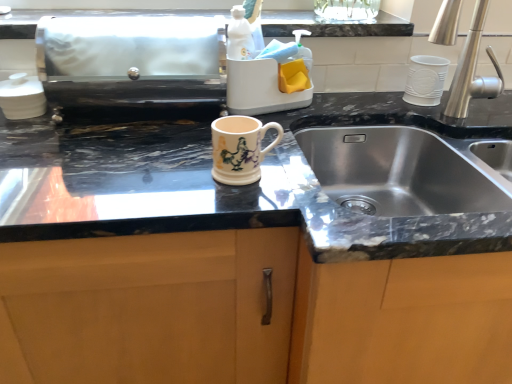
Question: From the image's perspective, would you say white glossy sink at upper center is shown under matte ceramic mug at center?

Choices:
 (A) yes
 (B) no

Answer: (B)

Question: From a real-world perspective, is white glossy sink at upper center positioned over matte ceramic mug at center based on gravity?

Choices:
 (A) yes
 (B) no

Answer: (A)

Question: From the image's perspective, is white glossy sink at upper center above matte ceramic mug at center?

Choices:
 (A) yes
 (B) no

Answer: (A)

Question: Is white glossy sink at upper center smaller than matte ceramic mug at center?

Choices:
 (A) yes
 (B) no

Answer: (B)

Question: Is white glossy sink at upper center taller than matte ceramic mug at center?

Choices:
 (A) yes
 (B) no

Answer: (B)

Question: From the image's perspective, relative to silver metallic faucet at right, is white glossy sink at upper center above or below?

Choices:
 (A) above
 (B) below

Answer: (A)

Question: Would you say white glossy sink at upper center is inside or outside silver metallic faucet at right?

Choices:
 (A) inside
 (B) outside

Answer: (B)

Question: Considering the positions of point (352, 33) and point (476, 82), is point (352, 33) closer or farther from the camera than point (476, 82)?

Choices:
 (A) closer
 (B) farther

Answer: (A)

Question: Considering the positions of white glossy sink at upper center and silver metallic faucet at right in the image, is white glossy sink at upper center taller or shorter than silver metallic faucet at right?

Choices:
 (A) tall
 (B) short

Answer: (B)

Question: From a real-world perspective, relative to matte ceramic mug at center, is silver metallic faucet at right vertically above or below?

Choices:
 (A) above
 (B) below

Answer: (A)

Question: Is point (502, 79) positioned closer to the camera than point (250, 170)?

Choices:
 (A) closer
 (B) farther

Answer: (B)

Question: Do you think silver metallic faucet at right is within matte ceramic mug at center, or outside of it?

Choices:
 (A) inside
 (B) outside

Answer: (B)

Question: Looking at their shapes, would you say silver metallic faucet at right is wider or thinner than matte ceramic mug at center?

Choices:
 (A) wide
 (B) thin

Answer: (A)

Question: Is point (45, 11) positioned closer to the camera than point (271, 122)?

Choices:
 (A) farther
 (B) closer

Answer: (A)

Question: Based on their positions, is white glossy sink at upper center located to the left or right of matte ceramic mug at center?

Choices:
 (A) left
 (B) right

Answer: (A)